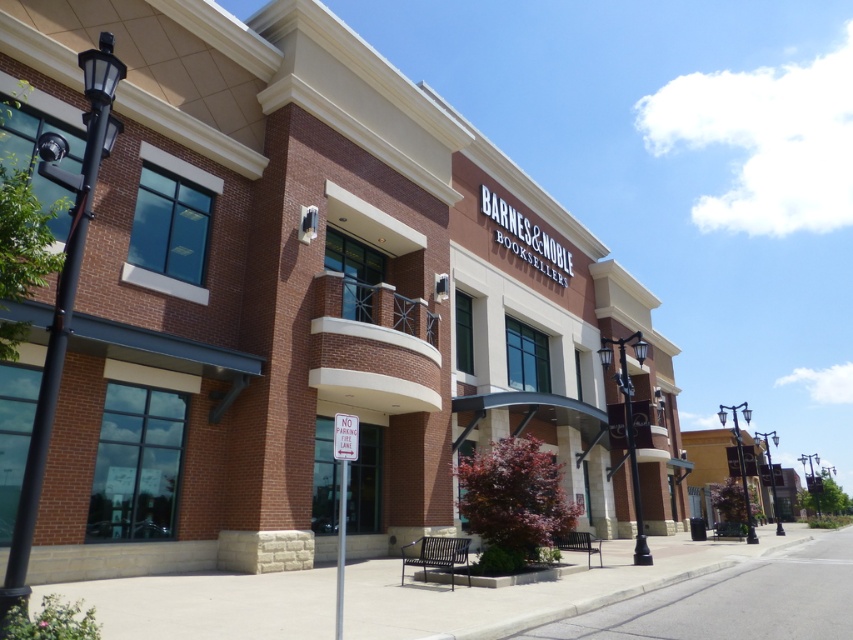
Between gray concrete pavement at lower center and polished metal streetlight at center-right, which one has less height?

gray concrete pavement at lower center is shorter.

This screenshot has height=640, width=853. Find the location of `gray concrete pavement at lower center`. gray concrete pavement at lower center is located at coordinates (625, 593).

Which of these two, gray concrete pavement at lower center or gray concrete sidewalk at lower center, stands taller?

gray concrete pavement at lower center is taller.

Describe the element at coordinates (625, 593) in the screenshot. I see `gray concrete pavement at lower center` at that location.

At what (x,y) coordinates should I click in order to perform the action: click on gray concrete pavement at lower center. Please return your answer as a coordinate pair (x, y). Looking at the image, I should click on (625, 593).

Find the location of a particular element. polished metal streetlight at center is located at coordinates (740, 460).

Is polished metal streetlight at center thinner than polished metal streetlight at center-right?

Indeed, polished metal streetlight at center has a lesser width compared to polished metal streetlight at center-right.

Locate an element on the screen. polished metal streetlight at center is located at coordinates (740, 460).

Identify the location of polished metal streetlight at center. (740, 460).